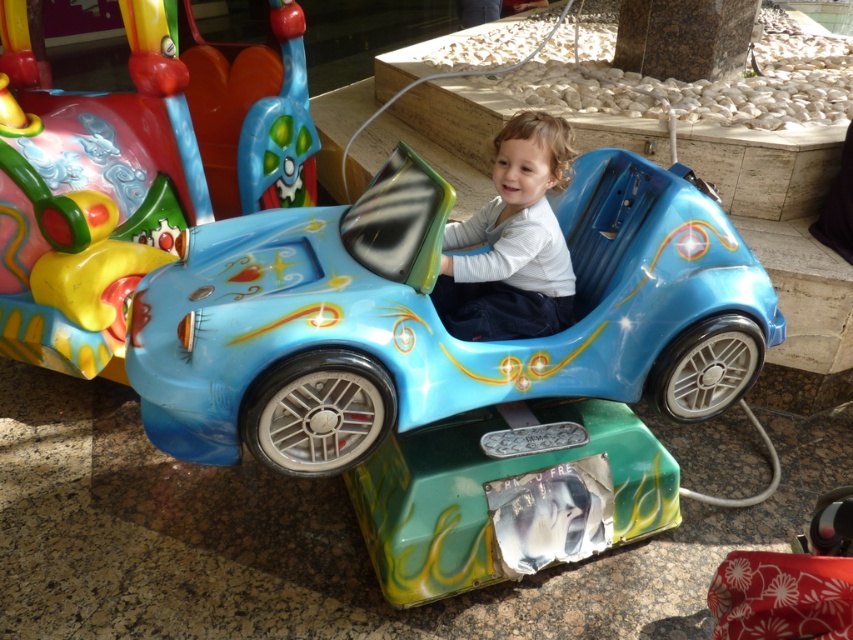
Does point (381, 330) come in front of point (154, 35)?

Yes, point (381, 330) is closer to viewer.

Does point (253, 387) come farther from viewer compared to point (78, 260)?

No, it is in front of (78, 260).

I want to click on shiny plastic toy car at center, so click(x=434, y=317).

Which of these two, shiny plastic toy car at center or matte blue car seat at center, stands shorter?

matte blue car seat at center

Who is more distant from viewer, (151, 300) or (526, 148)?

The point (526, 148) is behind.

Which is in front, point (387, 323) or point (482, 291)?

Point (387, 323)

In order to click on shiny plastic toy car at center in this screenshot , I will do `click(434, 317)`.

Measure the distance between point (x=136, y=74) and camera.

They are 2.79 meters apart.

This screenshot has height=640, width=853. I want to click on glossy plastic car at center, so click(x=90, y=193).